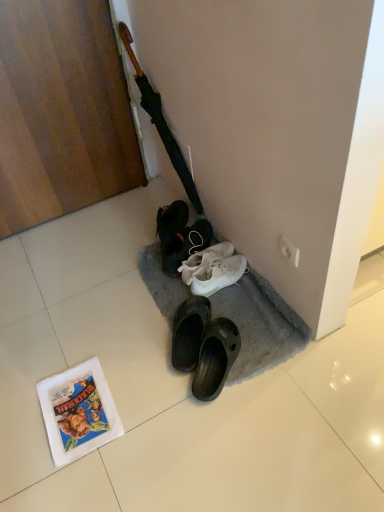
Locate an element on the screen. blank space above white paper comic book at lower left (from a real-world perspective) is located at coordinates tap(79, 407).